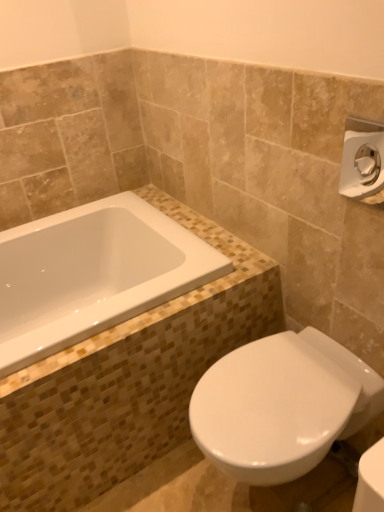
Question: Is white glossy bathtub at upper left thinner than satin nickel towel bar at upper right?

Choices:
 (A) no
 (B) yes

Answer: (A)

Question: From the image's perspective, is white glossy bathtub at upper left under satin nickel towel bar at upper right?

Choices:
 (A) yes
 (B) no

Answer: (A)

Question: From the image's perspective, is white glossy bathtub at upper left on top of satin nickel towel bar at upper right?

Choices:
 (A) no
 (B) yes

Answer: (A)

Question: Is white glossy bathtub at upper left smaller than satin nickel towel bar at upper right?

Choices:
 (A) yes
 (B) no

Answer: (B)

Question: Is white glossy bathtub at upper left to the left of satin nickel towel bar at upper right from the viewer's perspective?

Choices:
 (A) no
 (B) yes

Answer: (B)

Question: Is white glossy bathtub at upper left not inside satin nickel towel bar at upper right?

Choices:
 (A) yes
 (B) no

Answer: (A)

Question: From the image's perspective, does white glossy toilet at lower right appear higher than satin nickel towel bar at upper right?

Choices:
 (A) yes
 (B) no

Answer: (B)

Question: Is white glossy toilet at lower right placed right next to satin nickel towel bar at upper right?

Choices:
 (A) yes
 (B) no

Answer: (B)

Question: Is white glossy toilet at lower right far from satin nickel towel bar at upper right?

Choices:
 (A) no
 (B) yes

Answer: (A)

Question: Does white glossy toilet at lower right come behind satin nickel towel bar at upper right?

Choices:
 (A) yes
 (B) no

Answer: (A)

Question: Is white glossy toilet at lower right at the right side of satin nickel towel bar at upper right?

Choices:
 (A) yes
 (B) no

Answer: (B)

Question: Could you tell me if white glossy toilet at lower right is facing satin nickel towel bar at upper right?

Choices:
 (A) no
 (B) yes

Answer: (A)

Question: Does white glossy toilet at lower right have a larger size compared to white glossy bathtub at upper left?

Choices:
 (A) no
 (B) yes

Answer: (B)